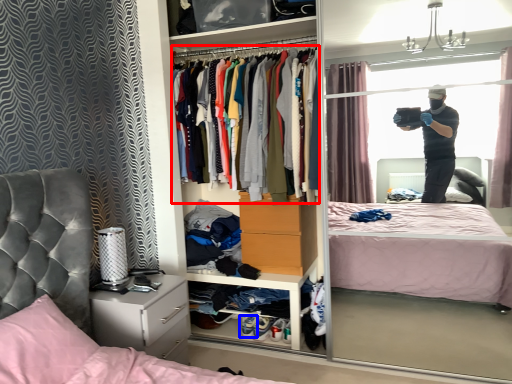
Question: Which point is further to the camera, clothing (highlighted by a red box) or footwear (highlighted by a blue box)?

Choices:
 (A) clothing
 (B) footwear

Answer: (B)